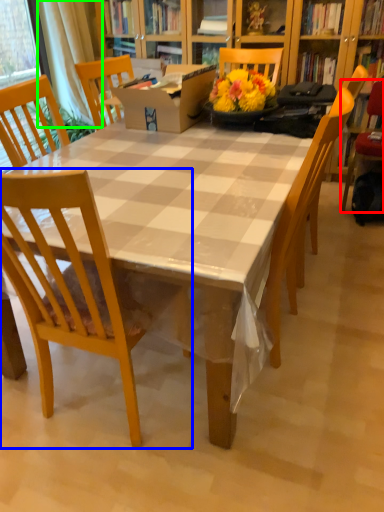
Question: Which is farther away from chair (highlighted by a red box)? chair (highlighted by a blue box) or curtain (highlighted by a green box)?

Choices:
 (A) chair
 (B) curtain

Answer: (B)